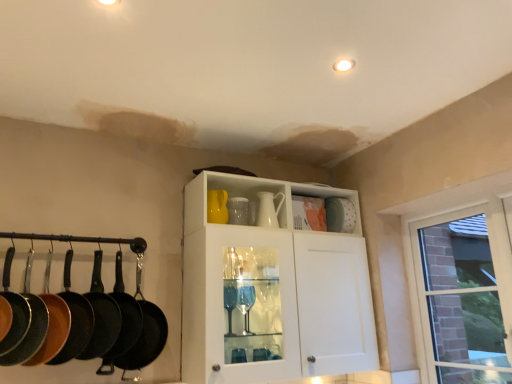
Question: From a real-world perspective, is white matte platter at upper right on top of matte yellow tea pot at upper center, the 1th tea pot viewed from the left?

Choices:
 (A) no
 (B) yes

Answer: (B)

Question: Does white matte platter at upper right have a smaller size compared to matte yellow tea pot at upper center, the 2th tea pot positioned from the right?

Choices:
 (A) no
 (B) yes

Answer: (A)

Question: From a real-world perspective, is white matte platter at upper right located beneath matte yellow tea pot at upper center, the 1th tea pot viewed from the left?

Choices:
 (A) yes
 (B) no

Answer: (B)

Question: Is white matte platter at upper right thinner than matte yellow tea pot at upper center, the 2th tea pot positioned from the right?

Choices:
 (A) no
 (B) yes

Answer: (A)

Question: Does white matte platter at upper right lie behind matte yellow tea pot at upper center, the 2th tea pot positioned from the right?

Choices:
 (A) yes
 (B) no

Answer: (A)

Question: Visually, is white matte platter at upper right positioned to the left or to the right of white glossy tea pot at center, which is counted as the 2th tea pot, starting from the left?

Choices:
 (A) left
 (B) right

Answer: (B)

Question: Considering the positions of point (344, 200) and point (266, 203), is point (344, 200) closer or farther from the camera than point (266, 203)?

Choices:
 (A) farther
 (B) closer

Answer: (A)

Question: In terms of size, does white matte platter at upper right appear bigger or smaller than white glossy tea pot at center, positioned as the first tea pot in right-to-left order?

Choices:
 (A) small
 (B) big

Answer: (A)

Question: From the image's perspective, relative to white glossy tea pot at center, which is counted as the 2th tea pot, starting from the left, is white matte platter at upper right above or below?

Choices:
 (A) above
 (B) below

Answer: (B)

Question: Relative to black cast iron frying pan at left, which ranks as the 1th frying pan in right-to-left order, is black cast iron frying pan at left, marked as the 4th frying pan in a left-to-right arrangement, in front or behind?

Choices:
 (A) front
 (B) behind

Answer: (A)

Question: Is black cast iron frying pan at left, marked as the 4th frying pan in a left-to-right arrangement, to the left or to the right of black cast iron frying pan at left, which ranks as the 1th frying pan in right-to-left order, in the image?

Choices:
 (A) right
 (B) left

Answer: (B)

Question: In terms of width, does black cast iron frying pan at left, marked as the 4th frying pan in a left-to-right arrangement, look wider or thinner when compared to black cast iron frying pan at left, the sixth frying pan positioned from the left?

Choices:
 (A) thin
 (B) wide

Answer: (A)

Question: Is point [96, 329] positioned closer to the camera than point [160, 337]?

Choices:
 (A) closer
 (B) farther

Answer: (A)

Question: Is white glossy tea pot at center, positioned as the first tea pot in right-to-left order, in front of or behind white matte platter at upper right in the image?

Choices:
 (A) front
 (B) behind

Answer: (A)

Question: From their relative heights in the image, would you say white glossy tea pot at center, which is counted as the 2th tea pot, starting from the left, is taller or shorter than white matte platter at upper right?

Choices:
 (A) tall
 (B) short

Answer: (A)